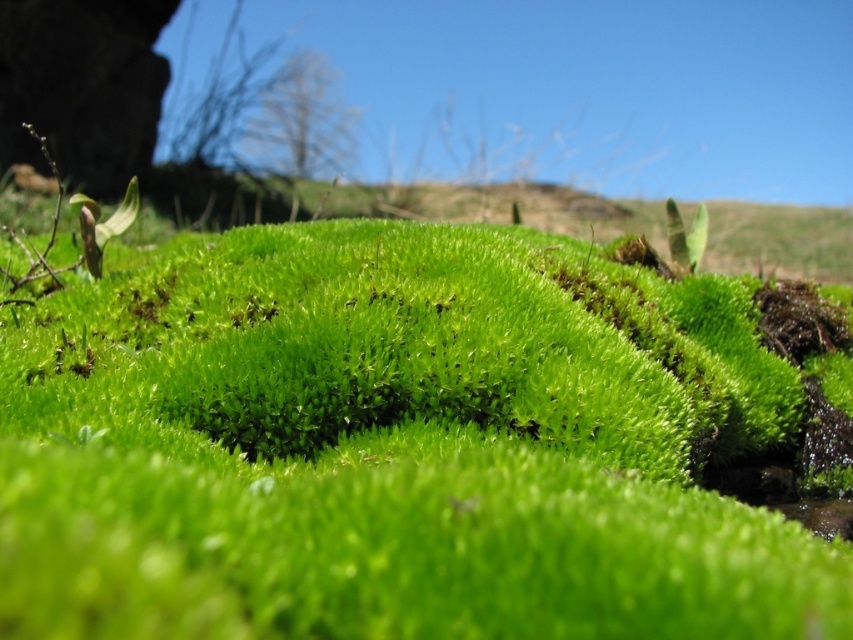
Question: Which object is farther from the camera taking this photo?

Choices:
 (A) green fuzzy moss at center
 (B) green soft moss at center

Answer: (A)

Question: Is green soft moss at center bigger than green fuzzy moss at center?

Choices:
 (A) no
 (B) yes

Answer: (B)

Question: Among these points, which one is farthest from the camera?

Choices:
 (A) (88, 244)
 (B) (764, 298)

Answer: (B)

Question: In this image, where is green soft moss at center located relative to green fuzzy moss at center?

Choices:
 (A) below
 (B) above

Answer: (A)

Question: Observing the image, what is the correct spatial positioning of green soft moss at center in reference to green fuzzy moss at center?

Choices:
 (A) right
 (B) left

Answer: (A)

Question: Which object is farther from the camera taking this photo?

Choices:
 (A) green fuzzy moss at center
 (B) green soft moss at center

Answer: (A)